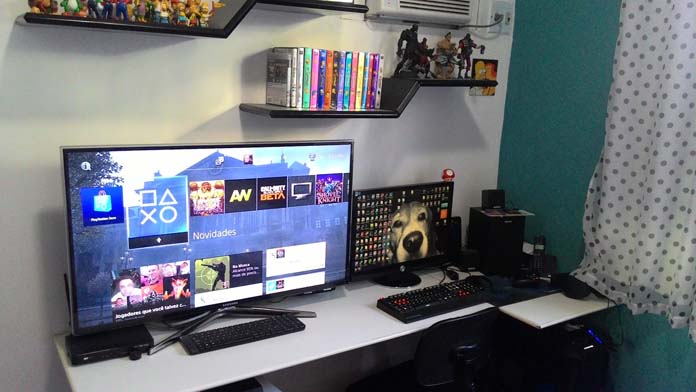
Find the location of a particular element. This screenshot has width=696, height=392. keyboard is located at coordinates (264, 332), (457, 299).